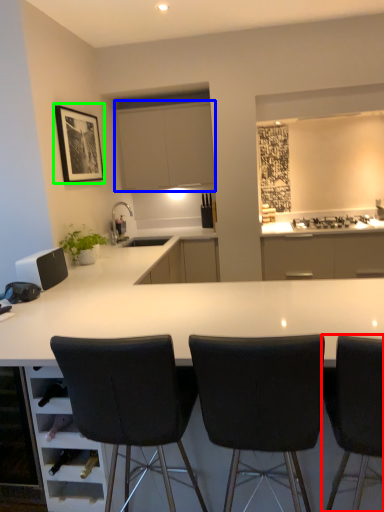
Question: Which is farther away from chair (highlighted by a red box)? cabinetry (highlighted by a blue box) or picture frame (highlighted by a green box)?

Choices:
 (A) cabinetry
 (B) picture frame

Answer: (A)